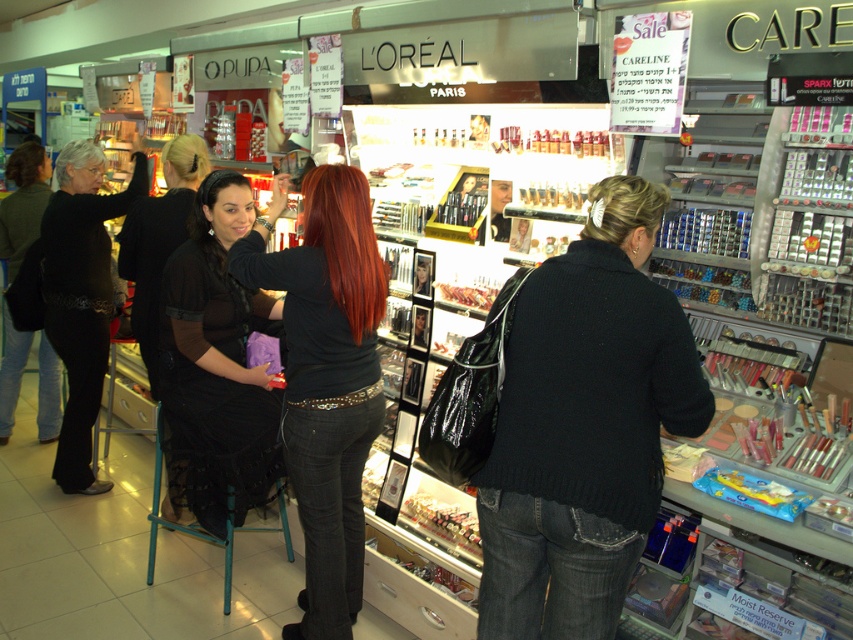
You are a customer in the store and want to ask the salesperson about the black lace dress at left and the blonde hair at upper center. Which one is closer to the entrance?

The black lace dress at left is closer to the entrance because it is positioned to the left of blonde hair at upper center, which would place it nearer to the entrance if the entrance is on the left side of the store.

You are a customer in the cosmetics store and you want to buy both the black leather dress at center and the blonde hair at center. The store has a rule that if one item is to the right of another, you can only buy the one on the right. Which item can you purchase?

The black leather dress at center can be purchased because it is positioned on the right side of blonde hair at center, so according to the store rule, you can only buy the one on the right.